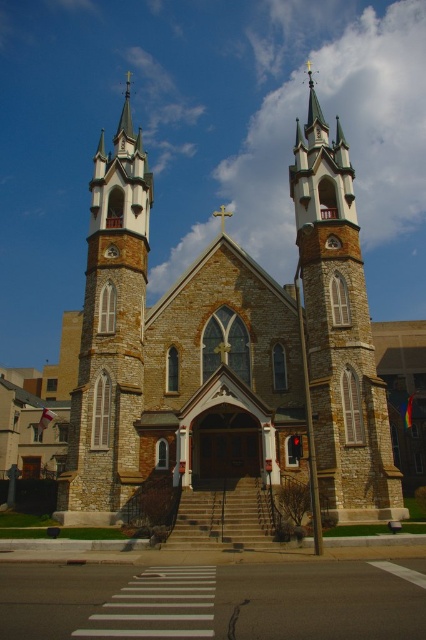
Question: Is the position of stone church at center more distant than that of stone steeple at left?

Choices:
 (A) yes
 (B) no

Answer: (B)

Question: Is stone church at center below stone steeple at left?

Choices:
 (A) no
 (B) yes

Answer: (B)

Question: Which of these objects is positioned farthest from the stone church at center?

Choices:
 (A) stone steeple at center
 (B) stone steeple at left

Answer: (B)

Question: Which object appears farthest from the camera in this image?

Choices:
 (A) stone steeple at left
 (B) stone church at center
 (C) stone steeple at center

Answer: (A)

Question: Is stone church at center to the left of stone steeple at left from the viewer's perspective?

Choices:
 (A) yes
 (B) no

Answer: (B)

Question: Which object is closer to the camera taking this photo?

Choices:
 (A) stone church at center
 (B) stone steeple at center

Answer: (A)